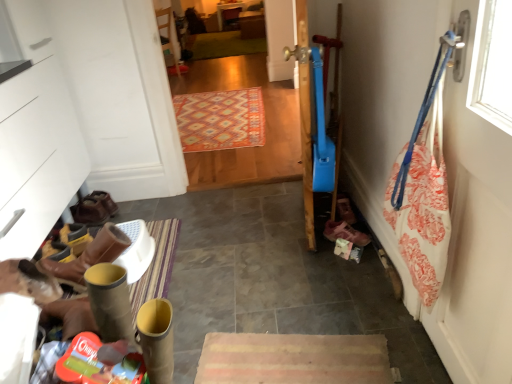
Locate an element on the screen. free space that is in between brown leather boots at lower left, marked as the 3th footwear in a front-to-back arrangement, and pink fabric shoe at lower right, which is the 1th footwear in front-to-back order is located at coordinates (218, 227).